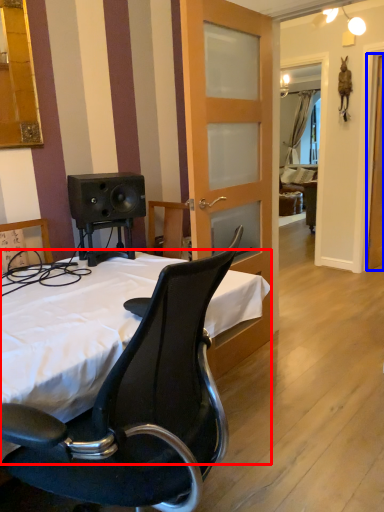
Question: Which object appears farthest to the camera in this image, bed (highlighted by a red box) or screen door (highlighted by a blue box)?

Choices:
 (A) bed
 (B) screen door

Answer: (B)